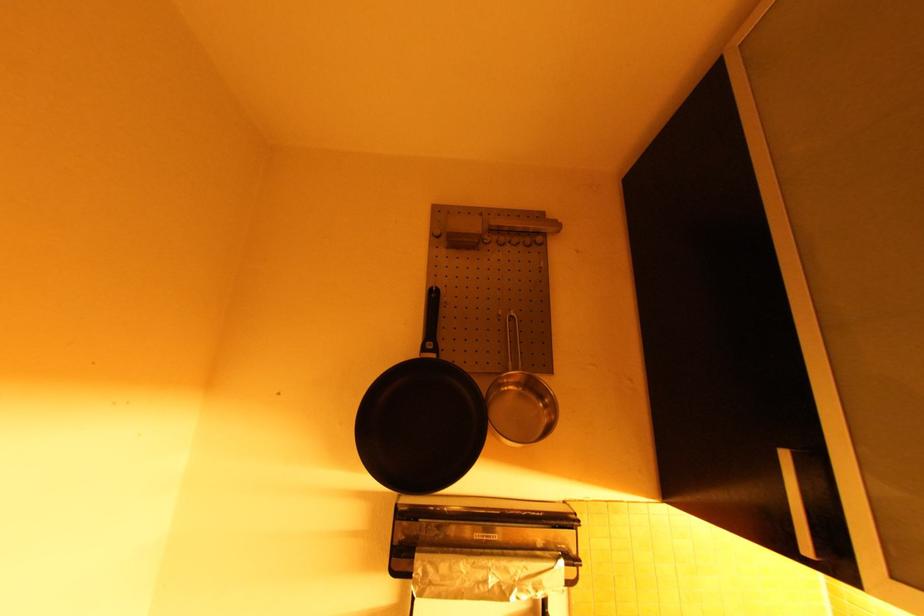
The location [485,573] corresponds to which object?

It refers to a aluminum foil.